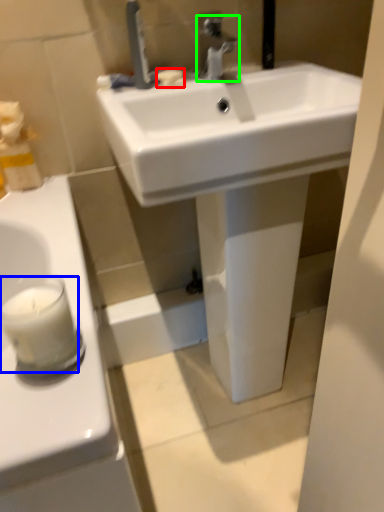
Question: Which object is positioned closest to soap (highlighted by a red box)? Select from candle (highlighted by a blue box) and tap (highlighted by a green box).

Choices:
 (A) candle
 (B) tap

Answer: (B)